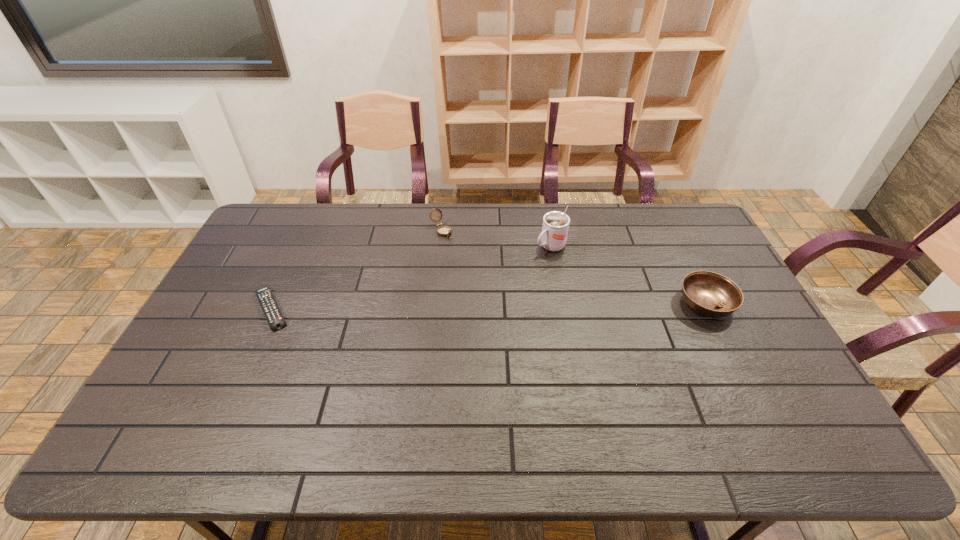
Find the location of a particular element. This screenshot has height=540, width=960. vacant area that lies between the tallest object and the compass is located at coordinates (495, 239).

Identify the location of free space between the third object from right to left and the cup. Image resolution: width=960 pixels, height=540 pixels. (495, 239).

Identify the location of vacant point located between the rightmost object and the tallest object. (628, 275).

Where is `free spot between the soup bowl and the remote control`? free spot between the soup bowl and the remote control is located at coordinates (489, 306).

Where is `the second closest object to the shortest object`? Image resolution: width=960 pixels, height=540 pixels. the second closest object to the shortest object is located at coordinates (555, 227).

You are a GUI agent. You are given a task and a screenshot of the screen. Output one action in this format:
    pyautogui.click(x=<x>, y=<y>)
    Task: Click on the object that can be found as the third closest to the third object from right to left
    The height and width of the screenshot is (540, 960).
    Given the screenshot: What is the action you would take?
    pyautogui.click(x=710, y=294)

Identify the location of vacant region that satisfies the following two spatial constraints: 1. on the front side of the rightmost object; 2. on the right side of the compass. This screenshot has height=540, width=960. (434, 303).

The width and height of the screenshot is (960, 540). Identify the location of vacant point that satisfies the following two spatial constraints: 1. on the back side of the rightmost object; 2. on the left side of the remote control. [274, 303].